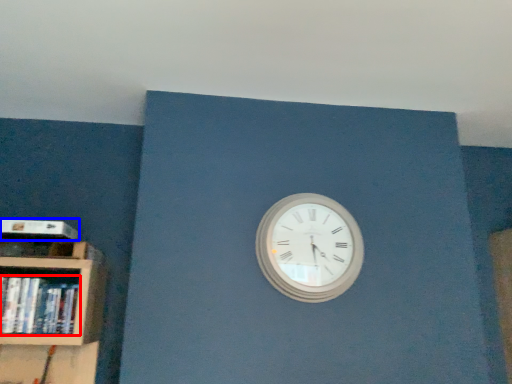
Question: Which of the following is the farthest to the observer, book (highlighted by a red box) or paperback book (highlighted by a blue box)?

Choices:
 (A) book
 (B) paperback book

Answer: (B)